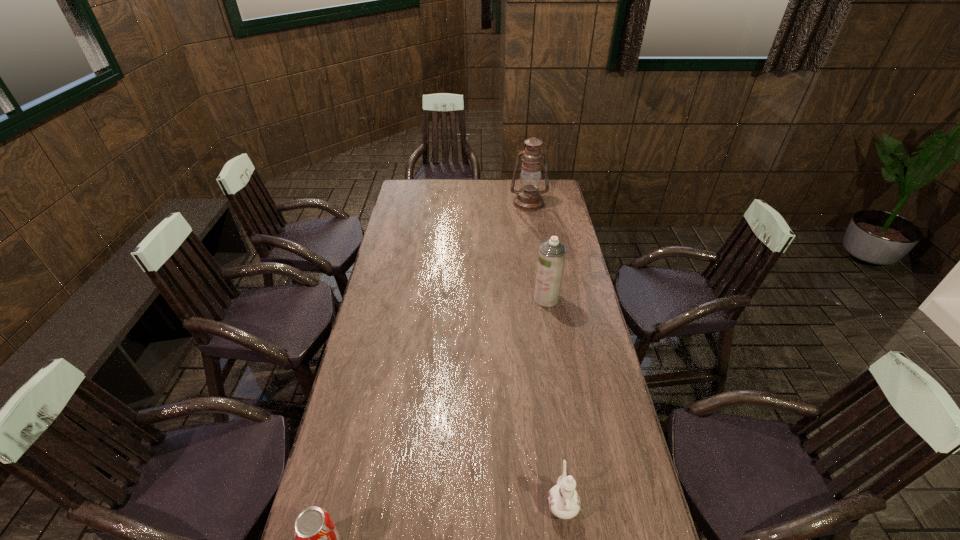
Locate an element on the screen. oil lamp is located at coordinates (528, 198).

You are a GUI agent. You are given a task and a screenshot of the screen. Output one action in this format:
    pyautogui.click(x=<x>, y=<y>)
    Task: Click on the farthest object
    The image size is (960, 540).
    Given the screenshot: What is the action you would take?
    pyautogui.click(x=528, y=198)

Image resolution: width=960 pixels, height=540 pixels. I want to click on the third shortest object, so pyautogui.click(x=552, y=253).

At what (x,y) coordinates should I click in order to perform the action: click on aerosol can. Please return your answer as a coordinate pair (x, y). This screenshot has height=540, width=960. Looking at the image, I should click on (552, 253).

Where is `chinaware`? chinaware is located at coordinates (563, 500).

Image resolution: width=960 pixels, height=540 pixels. I want to click on vacant space positioned 0.060m on the left of the tallest object, so click(498, 203).

You are a GUI agent. You are given a task and a screenshot of the screen. Output one action in this format:
    pyautogui.click(x=<x>, y=<y>)
    Task: Click on the free space located on the front of the second farthest object
    
    Given the screenshot: What is the action you would take?
    pyautogui.click(x=551, y=323)

The width and height of the screenshot is (960, 540). What are the coordinates of `vacant position located 0.330m at the spout of the chinaware` in the screenshot? It's located at (546, 387).

This screenshot has width=960, height=540. Identify the location of free space located at the spout of the chinaware. (556, 463).

At what (x,y) coordinates should I click in order to perform the action: click on blank space located at the spout of the chinaware. Please return your answer as a coordinate pair (x, y). Looking at the image, I should click on (555, 453).